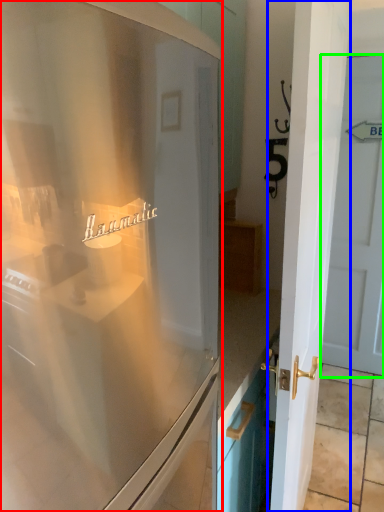
Question: Estimate the real-world distances between objects in this image. Which object is farther from refrigerator (highlighted by a red box), door (highlighted by a blue box) or door (highlighted by a green box)?

Choices:
 (A) door
 (B) door

Answer: (B)